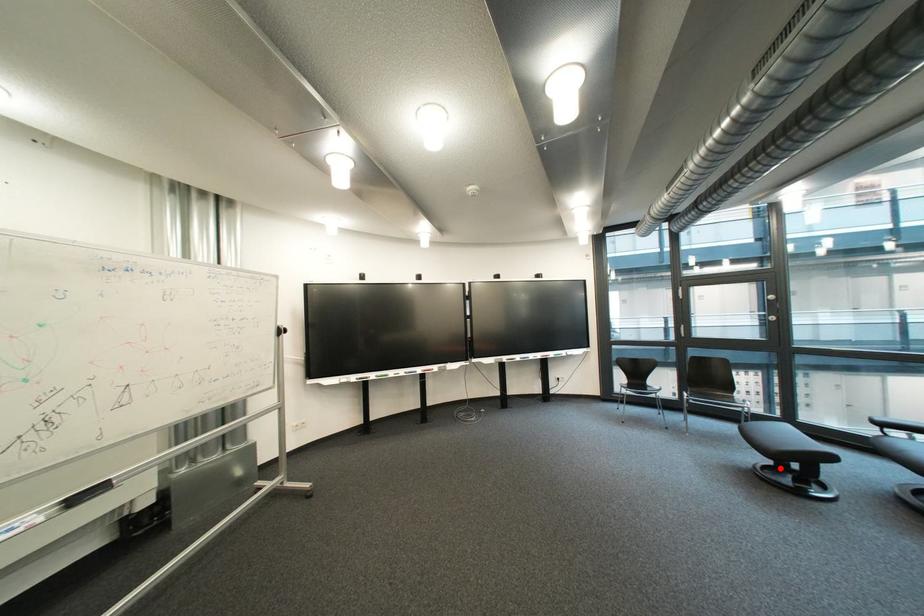
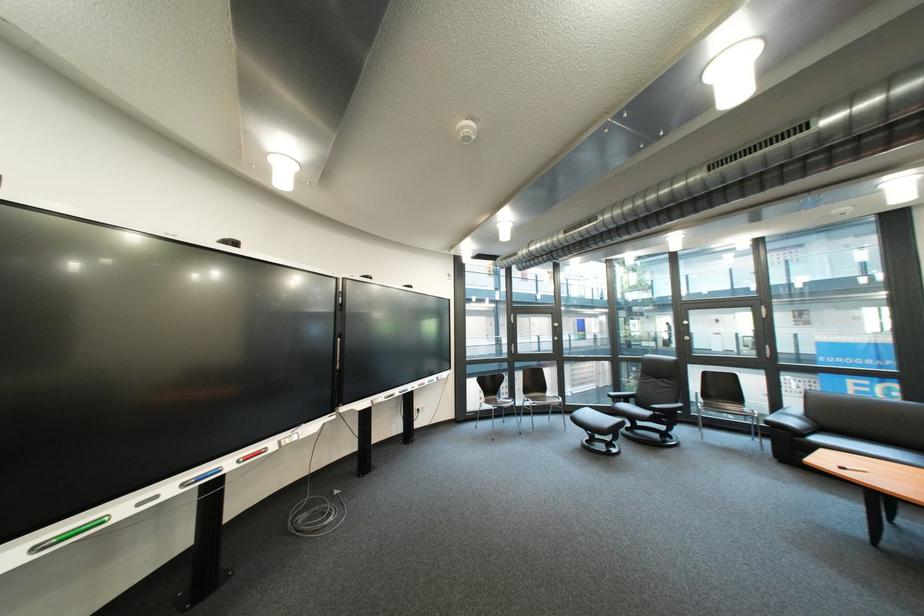
Question: I am providing you with two images of the same scene from different viewpoints. Image1 has a red point marked. In image2, the corresponding 3D location appears at what relative position? Reply with the corresponding letter.

Choices:
 (A) Closer
 (B) Farther

Answer: (B)